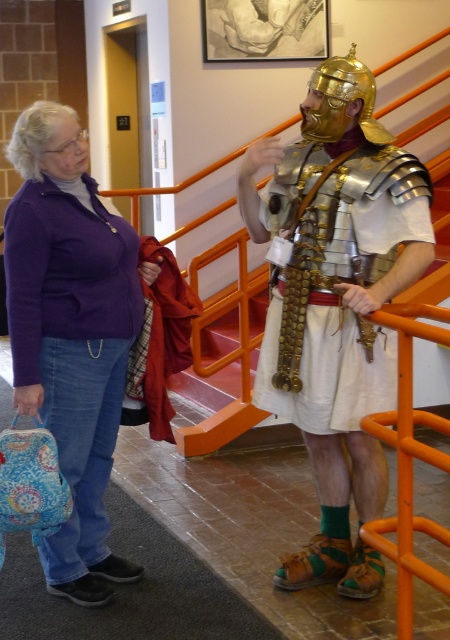
You are a photographer standing in the museum. You need to take a photo of both the shiny gold armor at center and the purple sweater at left. Can you see both objects in the same frame without moving your camera?

Yes, because the shiny gold armor at center is above the purple sweater at left, so they can be captured in the same frame.